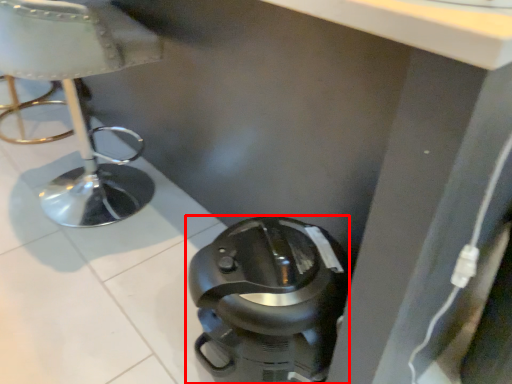
Question: From the image's perspective, where is home appliance (annotated by the red box) located relative to furniture?

Choices:
 (A) below
 (B) above

Answer: (A)